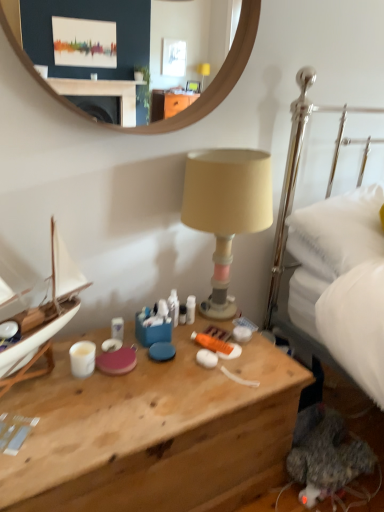
The height and width of the screenshot is (512, 384). Identify the location of vacant space situated on the left part of white glossy coffee cup at lower left. (45, 373).